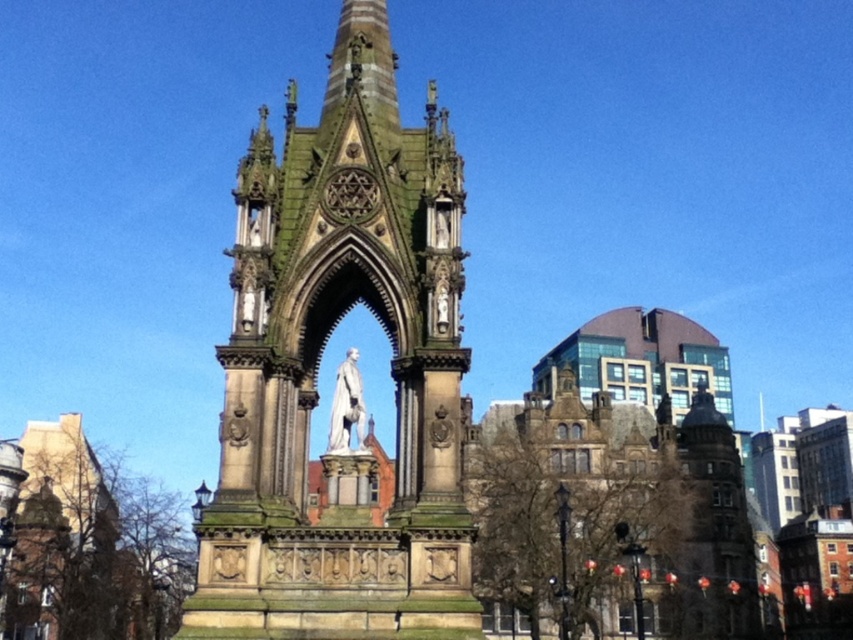
Question: Which point is farther to the camera?

Choices:
 (A) white marble statue at center
 (B) green stone tower at center

Answer: (A)

Question: Observing the image, what is the correct spatial positioning of green stone tower at center in reference to white marble statue at center?

Choices:
 (A) below
 (B) above

Answer: (B)

Question: Which of the following is the farthest from the observer?

Choices:
 (A) green stone tower at center
 (B) white marble statue at center

Answer: (B)

Question: Does green stone tower at center have a greater width compared to white marble statue at center?

Choices:
 (A) no
 (B) yes

Answer: (B)

Question: Does green stone tower at center have a lesser width compared to white marble statue at center?

Choices:
 (A) no
 (B) yes

Answer: (A)